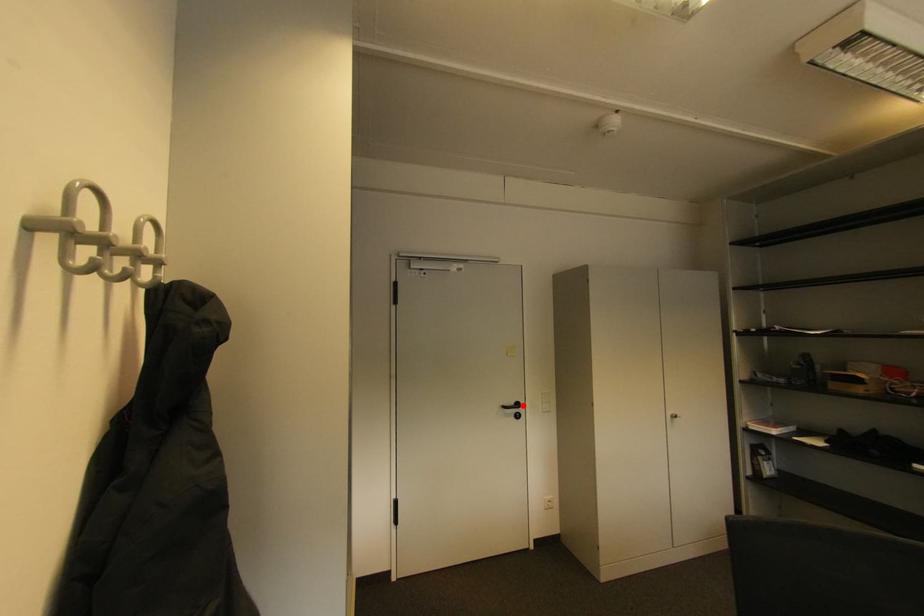
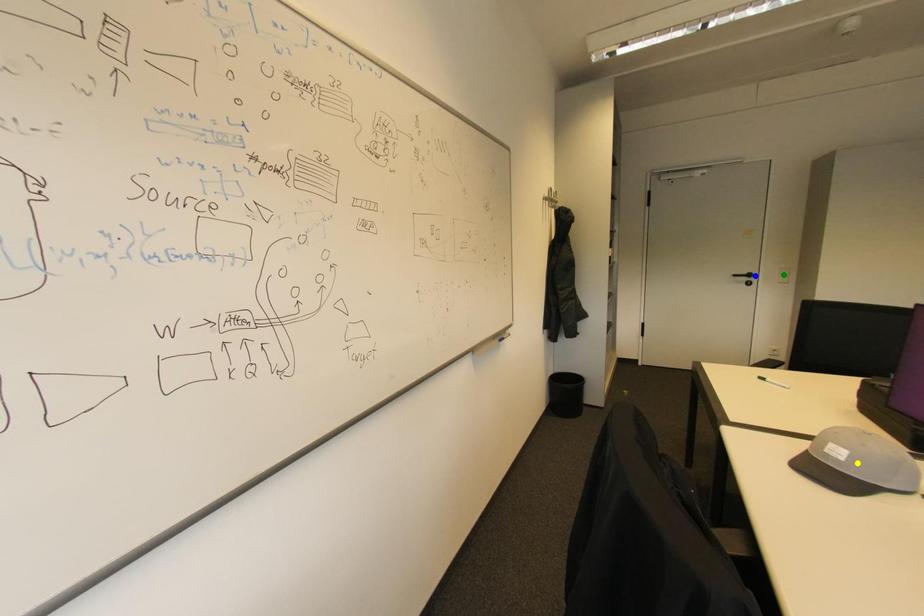
Question: I am providing you with two images of the same scene from different viewpoints. A red point is marked on the first image. You are given multiple points on the second image. In image 2, which mark is for the same physical point as the one in image 1?

Choices:
 (A) blue point
 (B) green point
 (C) yellow point

Answer: (A)